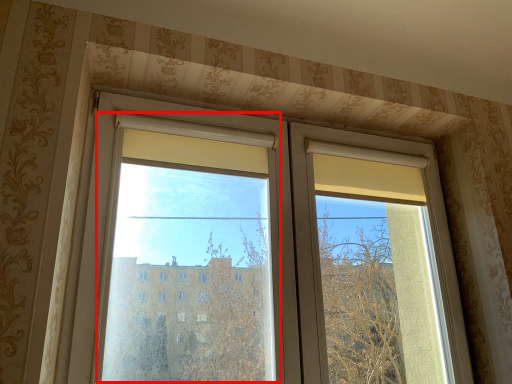
Question: From the image's perspective, considering the relative positions of window screen (annotated by the red box) and window in the image provided, where is window screen (annotated by the red box) located with respect to the staircase?

Choices:
 (A) below
 (B) above

Answer: (B)